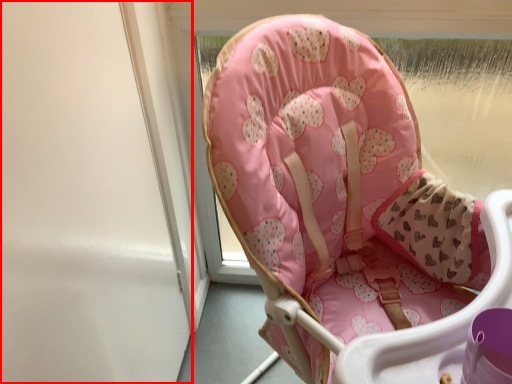
Question: From the image's perspective, considering the relative positions of screen door (annotated by the red box) and chair in the image provided, where is screen door (annotated by the red box) located with respect to the staircase?

Choices:
 (A) below
 (B) above

Answer: (B)